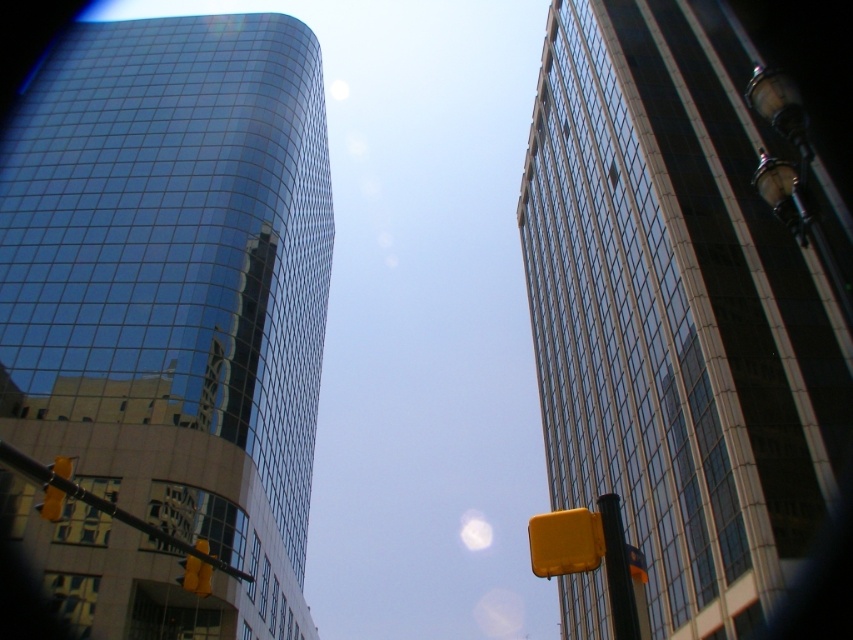
Question: Which point appears farthest from the camera in this image?

Choices:
 (A) (628, 545)
 (B) (59, 499)

Answer: (A)

Question: Is glassy reflective skyscraper at right positioned at the back of metallic yellow traffic light at right?

Choices:
 (A) yes
 (B) no

Answer: (A)

Question: Is yellow matte traffic light at center to the right of yellow matte traffic light at lower left from the viewer's perspective?

Choices:
 (A) no
 (B) yes

Answer: (B)

Question: Based on their relative distances, which object is nearer to the yellow matte traffic light at lower left?

Choices:
 (A) glassy reflective skyscraper at right
 (B) yellow plastic traffic light at left
 (C) shiny glass skyscraper at upper left
 (D) metallic yellow traffic light at right

Answer: (B)

Question: Observing the image, what is the correct spatial positioning of yellow plastic pole at lower left in reference to yellow matte traffic sign at right?

Choices:
 (A) right
 (B) left

Answer: (B)

Question: Which of the following is the closest to the observer?

Choices:
 (A) yellow matte traffic sign at right
 (B) yellow matte traffic light at center
 (C) glassy reflective skyscraper at right
 (D) yellow plastic traffic light at left

Answer: (B)